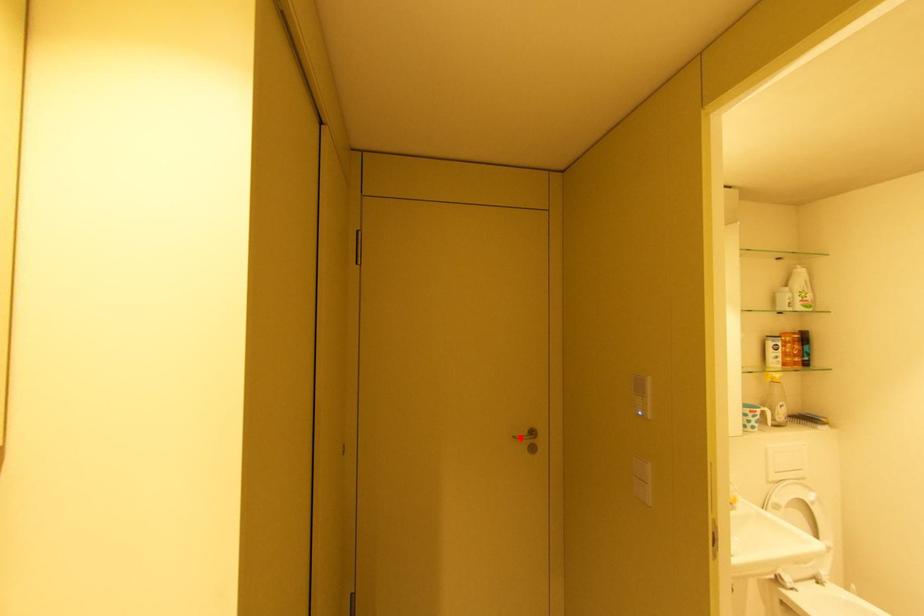
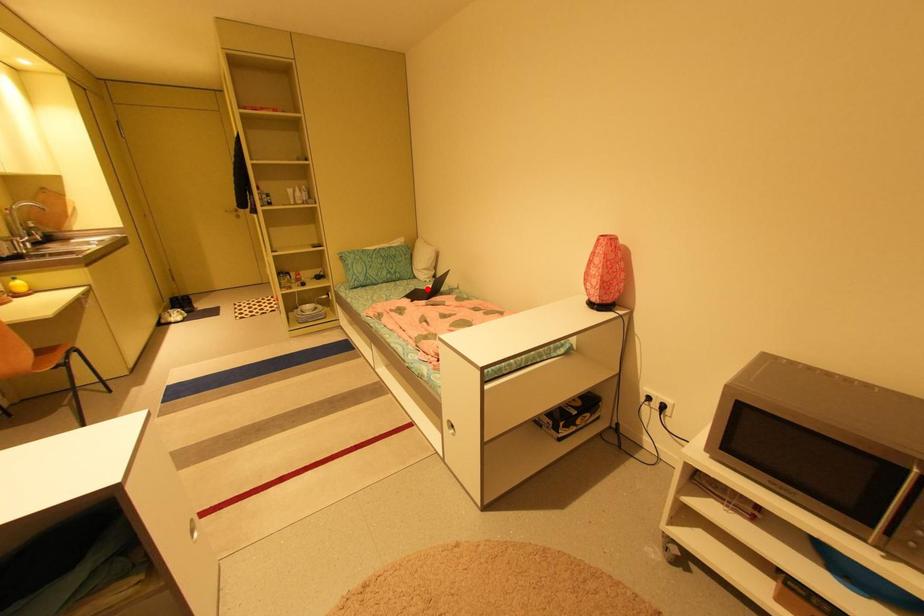
I am providing you with two images of the same scene from different viewpoints. A red point is marked on the first image and another point is marked on the second image. Is the red point in image1 aligned with the point shown in image2?

No